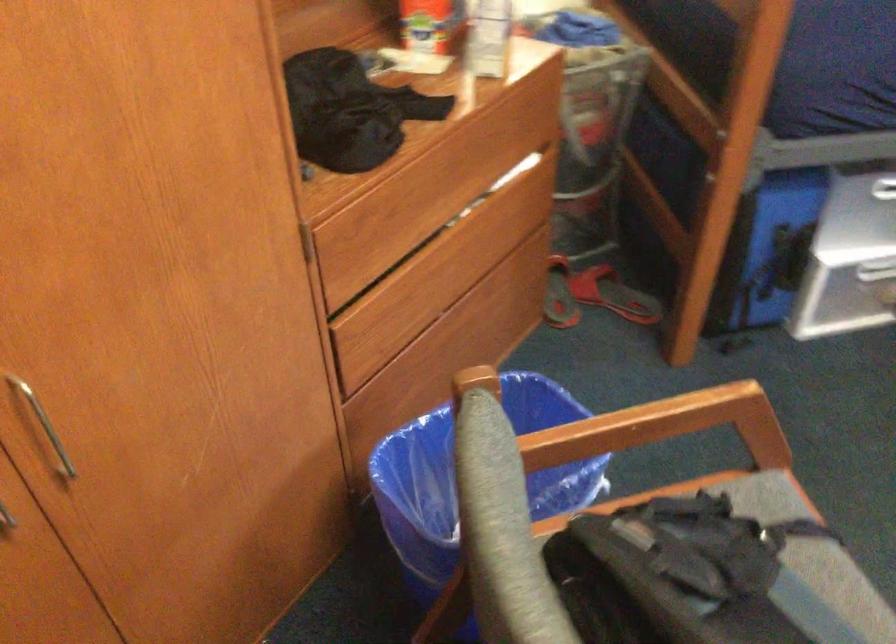
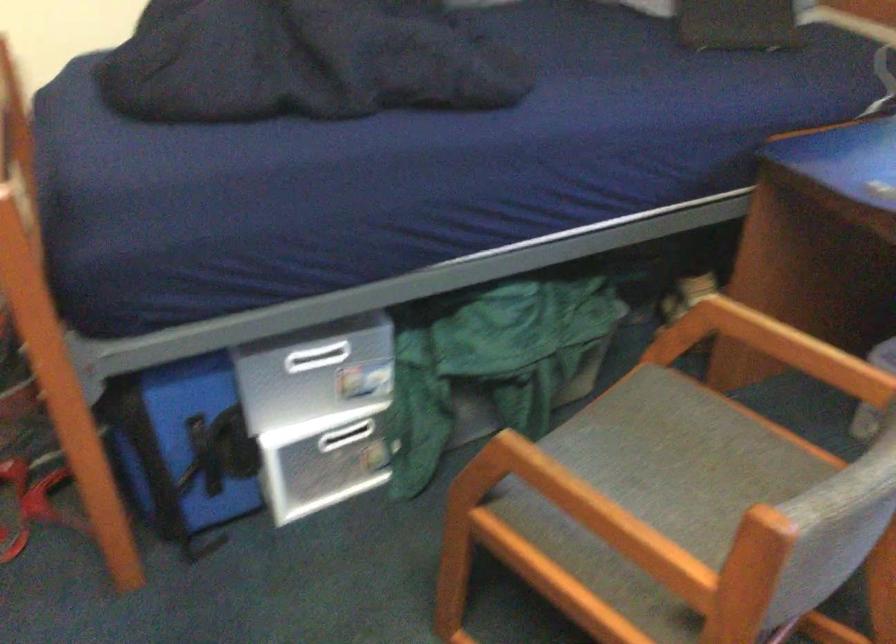
Question: I am providing you with two images of the same scene from different viewpoints. Please identify which objects are invisible in image2.

Choices:
 (A) red sandal
 (B) blue bag handle
 (C) wooden clothes hanger
 (D) white drawer handle

Answer: (A)